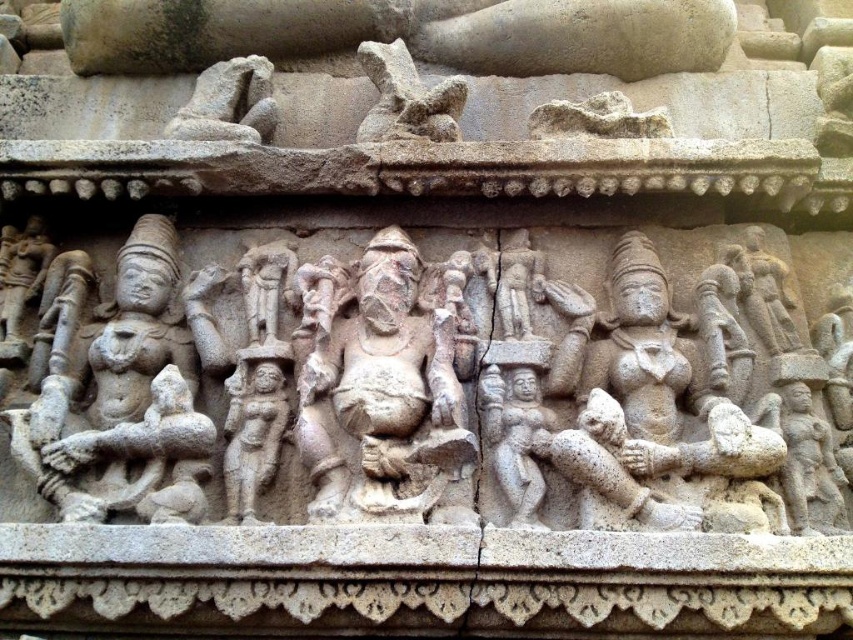
Does stone carving of deities at center come in front of gray stone carving at upper center?

Yes, it is in front of gray stone carving at upper center.

Can you confirm if stone carving of deities at center is bigger than gray stone carving at upper center?

Yes.

Which is in front, point (206, 257) or point (399, 109)?

Point (206, 257) is in front.

Find the location of `stone carving of deities at center`. stone carving of deities at center is located at coordinates (421, 387).